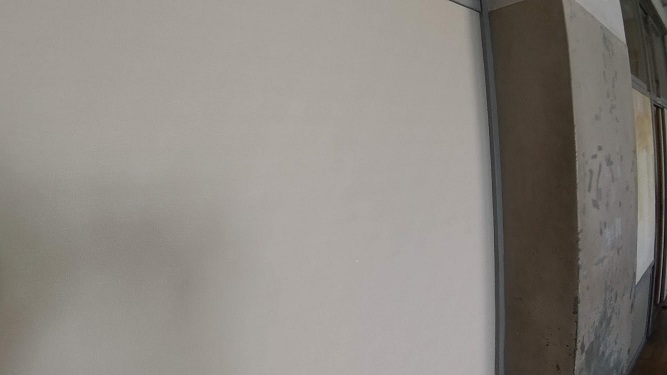
Provide coordinates for each where you would hang student's art work instance in the image. Your answer should be formatted as a list of tuples, i.e. [(x1, y1), (x2, y2), ...], where each tuple contains the x and y coordinates of a point satisfying the conditions above.

[(646, 177)]